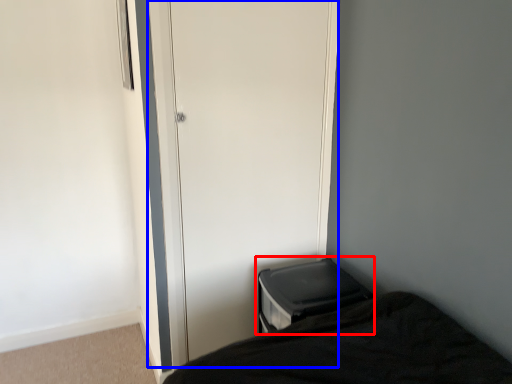
Question: Which of the following is the closest to the observer, changing table (highlighted by a red box) or screen door (highlighted by a blue box)?

Choices:
 (A) changing table
 (B) screen door

Answer: (B)